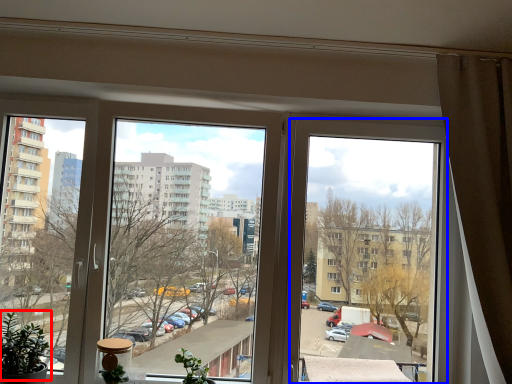
Question: Which object is closer to the camera taking this photo, plant (highlighted by a red box) or window (highlighted by a blue box)?

Choices:
 (A) plant
 (B) window

Answer: (A)